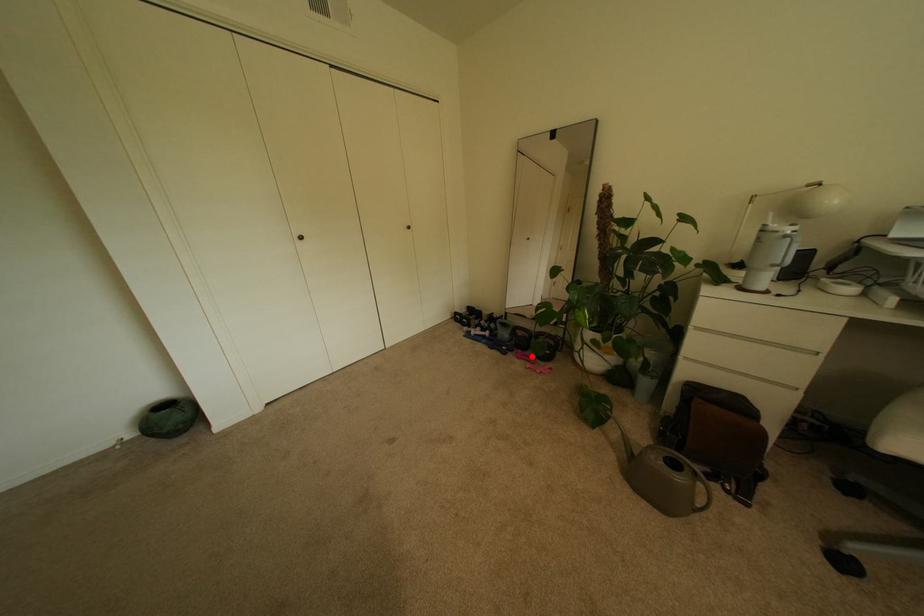
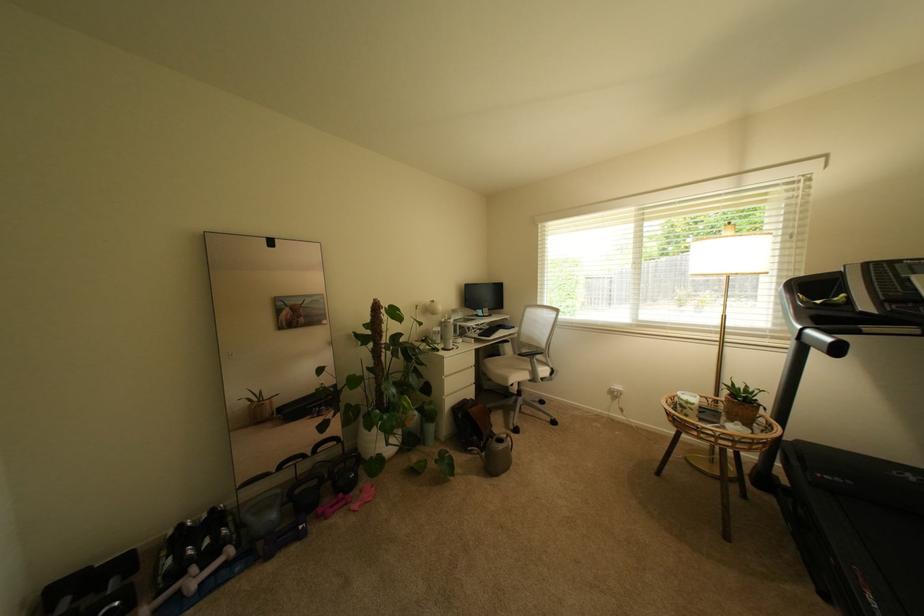
Question: A red point is marked in image1. In image2, is the corresponding 3D point closer to the camera or farther? Reply with the corresponding letter.

Choices:
 (A) The corresponding 3D point is closer.
 (B) The corresponding 3D point is farther.

Answer: (A)